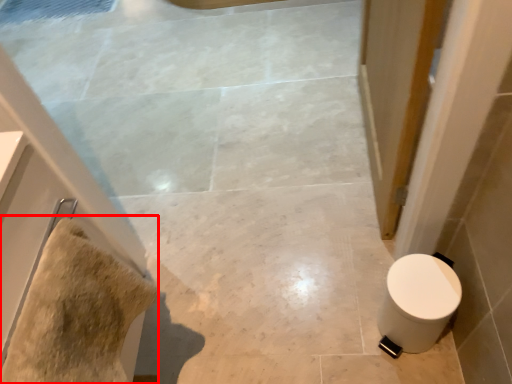
Question: From the image's perspective, where is material (annotated by the red box) located relative to toilet?

Choices:
 (A) below
 (B) above

Answer: (B)